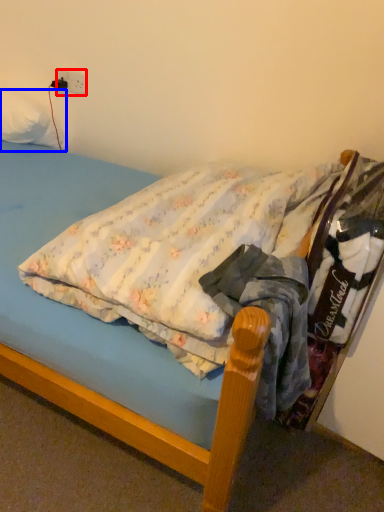
Question: Which object is further to the camera taking this photo, electric outlet (highlighted by a red box) or pillow (highlighted by a blue box)?

Choices:
 (A) electric outlet
 (B) pillow

Answer: (A)